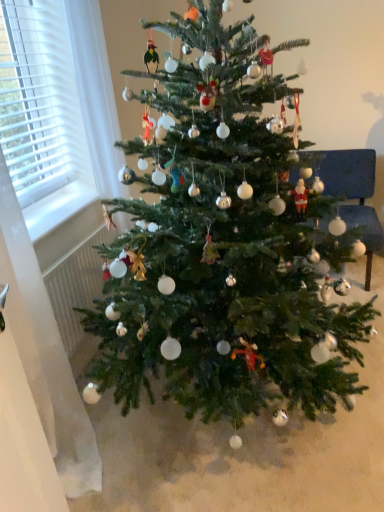
Identify the location of velvet blue armchair at right. This screenshot has width=384, height=512. (352, 192).

What do you see at coordinates (352, 192) in the screenshot? This screenshot has height=512, width=384. I see `velvet blue armchair at right` at bounding box center [352, 192].

This screenshot has width=384, height=512. I want to click on green matte christmas tree at center, so click(221, 245).

The image size is (384, 512). Describe the element at coordinates (221, 245) in the screenshot. I see `green matte christmas tree at center` at that location.

Identify the location of velvet blue armchair at right. pyautogui.click(x=352, y=192).

Based on their positions, is green matte christmas tree at center located to the left or right of velvet blue armchair at right?

In the image, green matte christmas tree at center appears on the left side of velvet blue armchair at right.

In the image, is green matte christmas tree at center positioned in front of or behind velvet blue armchair at right?

Clearly, green matte christmas tree at center is in front of velvet blue armchair at right.

Is point (154, 157) farther from viewer compared to point (336, 183)?

That is False.

From the image's perspective, between green matte christmas tree at center and velvet blue armchair at right, which one is located above?

velvet blue armchair at right, from the image's perspective.

From a real-world perspective, is green matte christmas tree at center positioned above or below velvet blue armchair at right?

In terms of real-world spatial position, green matte christmas tree at center is above velvet blue armchair at right.

Considering the sizes of objects green matte christmas tree at center and velvet blue armchair at right in the image provided, who is wider, green matte christmas tree at center or velvet blue armchair at right?

green matte christmas tree at center is wider.

Considering the sizes of objects green matte christmas tree at center and velvet blue armchair at right in the image provided, who is taller, green matte christmas tree at center or velvet blue armchair at right?

With more height is green matte christmas tree at center.

Between green matte christmas tree at center and velvet blue armchair at right, which one has larger size?

green matte christmas tree at center is bigger.

Would you say green matte christmas tree at center is outside velvet blue armchair at right?

Yes.

Is there a large distance between green matte christmas tree at center and velvet blue armchair at right?

green matte christmas tree at center is far away from velvet blue armchair at right.

Could you tell me if green matte christmas tree at center is turned towards velvet blue armchair at right?

No, green matte christmas tree at center is not aimed at velvet blue armchair at right.

What's the angular difference between green matte christmas tree at center and velvet blue armchair at right's facing directions?

The angular difference between green matte christmas tree at center and velvet blue armchair at right is 89.5 degrees.

Measure the distance from green matte christmas tree at center to velvet blue armchair at right.

green matte christmas tree at center is 3.51 feet away from velvet blue armchair at right.

The image size is (384, 512). Find the location of `armchair located underneath the green matte christmas tree at center (from a real-world perspective)`. armchair located underneath the green matte christmas tree at center (from a real-world perspective) is located at coordinates (352, 192).

Can you confirm if velvet blue armchair at right is positioned to the right of green matte christmas tree at center?

Yes.

Which is behind, velvet blue armchair at right or green matte christmas tree at center?

Positioned behind is velvet blue armchair at right.

Between point (361, 182) and point (331, 389), which one is positioned in front?

The point (331, 389) is closer.

From the image's perspective, is velvet blue armchair at right positioned above or below green matte christmas tree at center?

From the image's perspective, velvet blue armchair at right appears above green matte christmas tree at center.

Based on the photo, from a real-world perspective, is velvet blue armchair at right over green matte christmas tree at center?

No, from a real-world perspective, velvet blue armchair at right is not above green matte christmas tree at center.

Between velvet blue armchair at right and green matte christmas tree at center, which one has smaller width?

Thinner between the two is velvet blue armchair at right.

Between velvet blue armchair at right and green matte christmas tree at center, which one has more height?

Standing taller between the two is green matte christmas tree at center.

Is velvet blue armchair at right bigger or smaller than green matte christmas tree at center?

Clearly, velvet blue armchair at right is smaller in size than green matte christmas tree at center.

Is velvet blue armchair at right inside or outside of green matte christmas tree at center?

velvet blue armchair at right cannot be found inside green matte christmas tree at center.

Is velvet blue armchair at right far away from green matte christmas tree at center?

That's right, there is a large distance between velvet blue armchair at right and green matte christmas tree at center.

Is velvet blue armchair at right aimed at green matte christmas tree at center?

Yes, velvet blue armchair at right is aimed at green matte christmas tree at center.

Can you tell me how much velvet blue armchair at right and green matte christmas tree at center differ in facing direction?

velvet blue armchair at right and green matte christmas tree at center are facing 89.5 degrees away from each other.

How distant is velvet blue armchair at right from green matte christmas tree at center?

The distance of velvet blue armchair at right from green matte christmas tree at center is 3.51 feet.

What are the coordinates of `christmas tree above the velvet blue armchair at right (from a real-world perspective)` in the screenshot? It's located at (221, 245).

This screenshot has height=512, width=384. In order to click on christmas tree on the left of velvet blue armchair at right in this screenshot , I will do `click(221, 245)`.

I want to click on armchair behind the green matte christmas tree at center, so click(x=352, y=192).